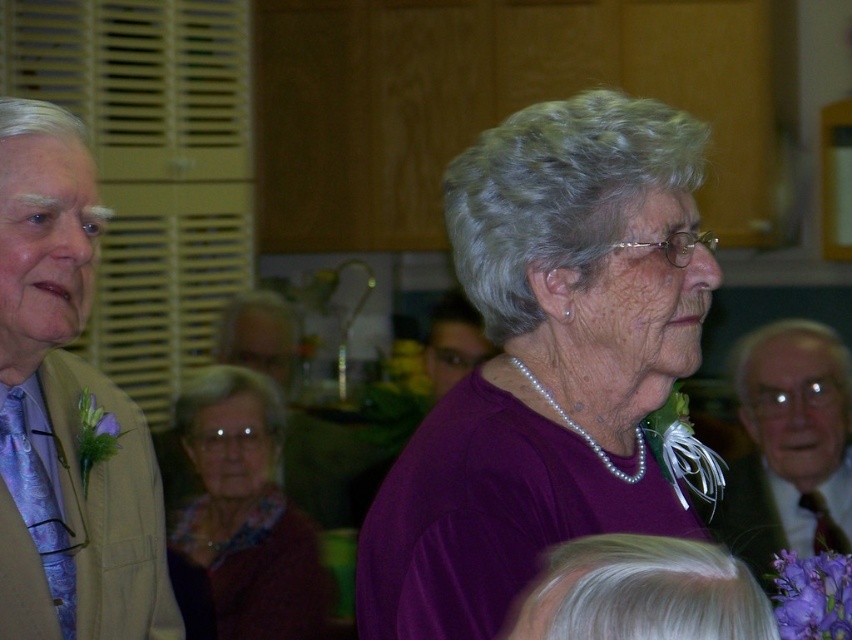
Does purple matte shirt at center come in front of matte purple sweater at center?

Yes.

Is purple matte shirt at center smaller than matte purple sweater at center?

Indeed, purple matte shirt at center has a smaller size compared to matte purple sweater at center.

Who is more forward, (580, 177) or (223, 636)?

Point (580, 177) is more forward.

Where is `purple matte shirt at center`? The width and height of the screenshot is (852, 640). purple matte shirt at center is located at coordinates (547, 362).

Between purple matte shirt at center and matte brown suit at right, which one appears on the right side from the viewer's perspective?

Positioned to the right is matte brown suit at right.

Locate an element on the screen. This screenshot has height=640, width=852. purple matte shirt at center is located at coordinates (547, 362).

In order to click on purple matte shirt at center in this screenshot , I will do `click(547, 362)`.

What do you see at coordinates (65, 410) in the screenshot? This screenshot has height=640, width=852. I see `silky beige suit at left` at bounding box center [65, 410].

The image size is (852, 640). What are the coordinates of `silky beige suit at left` in the screenshot? It's located at (65, 410).